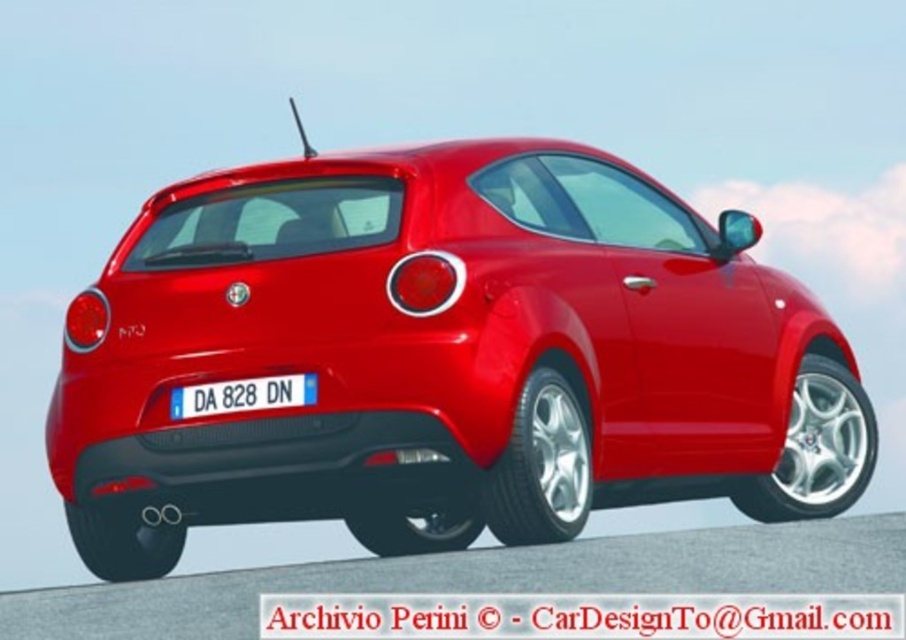
Can you confirm if glossy red car at center is shorter than white plastic license plate at center?

In fact, glossy red car at center may be taller than white plastic license plate at center.

Is point (137, 440) farther from camera compared to point (253, 396)?

Yes.

The width and height of the screenshot is (906, 640). Find the location of `glossy red car at center`. glossy red car at center is located at coordinates (444, 356).